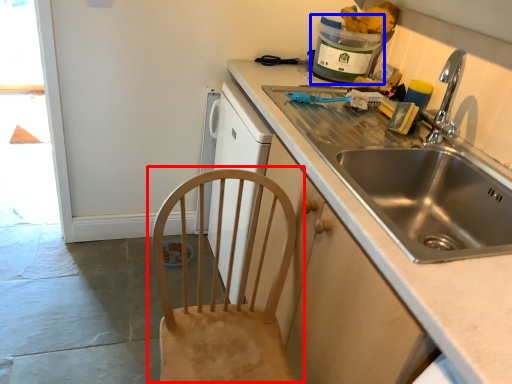
Question: Among these objects, which one is farthest to the camera, chair (highlighted by a red box) or appliance (highlighted by a blue box)?

Choices:
 (A) chair
 (B) appliance

Answer: (B)